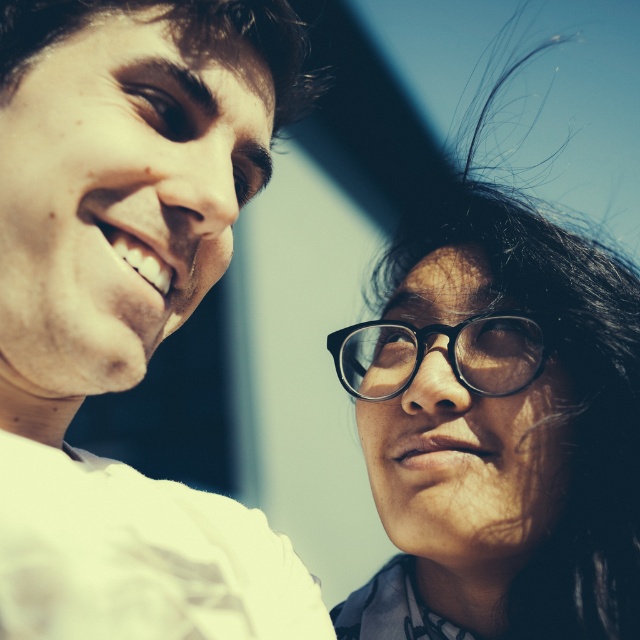
Question: Does matte white shirt at left have a lesser width compared to black plastic glasses at right?

Choices:
 (A) no
 (B) yes

Answer: (B)

Question: Which of the following is the closest to the observer?

Choices:
 (A) (564, 502)
 (B) (156, 152)

Answer: (B)

Question: Can you confirm if matte white shirt at left is positioned to the left of black plastic glasses at right?

Choices:
 (A) no
 (B) yes

Answer: (B)

Question: Does matte white shirt at left appear on the left side of black plastic glasses at right?

Choices:
 (A) no
 (B) yes

Answer: (B)

Question: Based on their relative distances, which object is nearer to the matte white shirt at left?

Choices:
 (A) black plastic glasses at lower right
 (B) black plastic glasses at right

Answer: (B)

Question: Among these points, which one is nearest to the camera?

Choices:
 (A) (508, 316)
 (B) (67, 97)

Answer: (B)